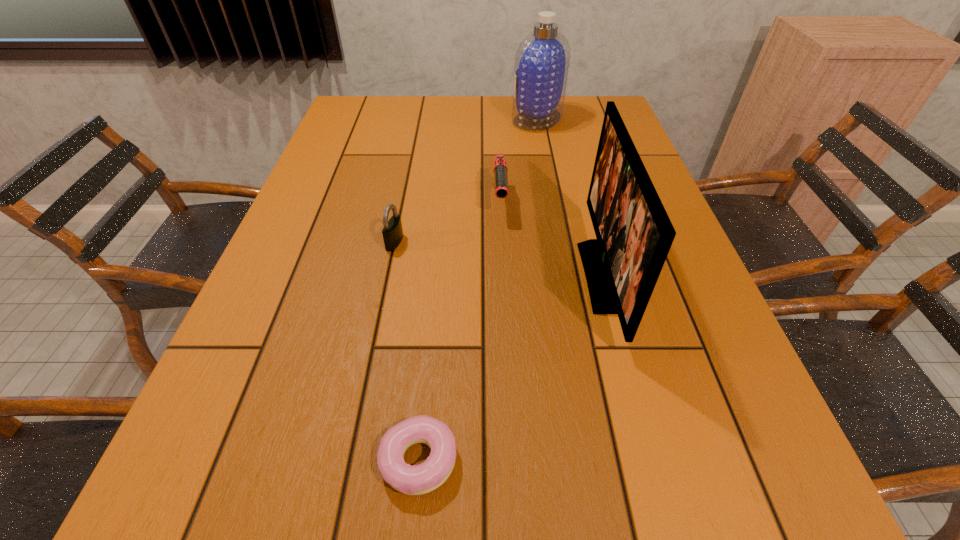
What are the coordinates of `free area in between the padlock and the gun` in the screenshot? It's located at (447, 222).

I want to click on vacant area between the padlock and the third object from right to left, so click(x=447, y=222).

At what (x,y) coordinates should I click in order to perform the action: click on vacant area that lies between the farthest object and the monitor. Please return your answer as a coordinate pair (x, y). Looking at the image, I should click on (569, 198).

Locate an element on the screen. This screenshot has height=540, width=960. vacant area between the shortest object and the third object from right to left is located at coordinates (459, 330).

This screenshot has height=540, width=960. Identify the location of empty space that is in between the leftmost object and the farthest object. [466, 180].

Where is `empty space that is in between the fourth object from right to left and the third object from right to left`? The image size is (960, 540). empty space that is in between the fourth object from right to left and the third object from right to left is located at coordinates click(x=459, y=330).

You are a GUI agent. You are given a task and a screenshot of the screen. Output one action in this format:
    pyautogui.click(x=<x>, y=<y>)
    Task: Click on the free point between the padlock and the third object from left to right
    
    Given the screenshot: What is the action you would take?
    pyautogui.click(x=447, y=222)

Image resolution: width=960 pixels, height=540 pixels. Identify the location of vacant space that is in between the shortest object and the monitor. click(510, 368).

I want to click on free spot between the cleansing agent and the padlock, so point(466,180).

At what (x,y) coordinates should I click in order to perform the action: click on vacant space that's between the cleansing agent and the padlock. Please return your answer as a coordinate pair (x, y). Image resolution: width=960 pixels, height=540 pixels. Looking at the image, I should click on (466, 180).